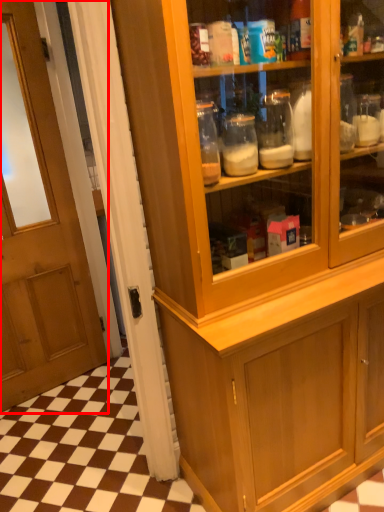
Question: From the image's perspective, considering the relative positions of door (annotated by the red box) and cabinetry in the image provided, where is door (annotated by the red box) located with respect to the staircase?

Choices:
 (A) above
 (B) below

Answer: (A)